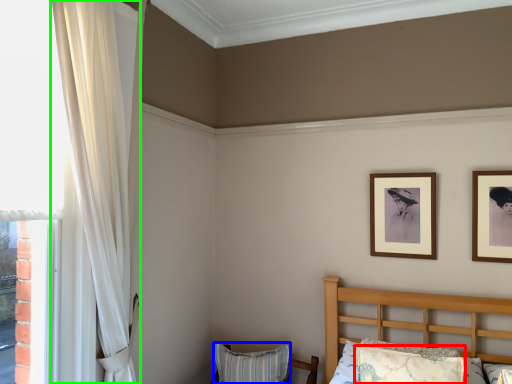
Question: Based on their relative distances, which object is farther from pillow (highlighted by a red box)? Choose from pillow (highlighted by a blue box) and curtain (highlighted by a green box).

Choices:
 (A) pillow
 (B) curtain

Answer: (B)